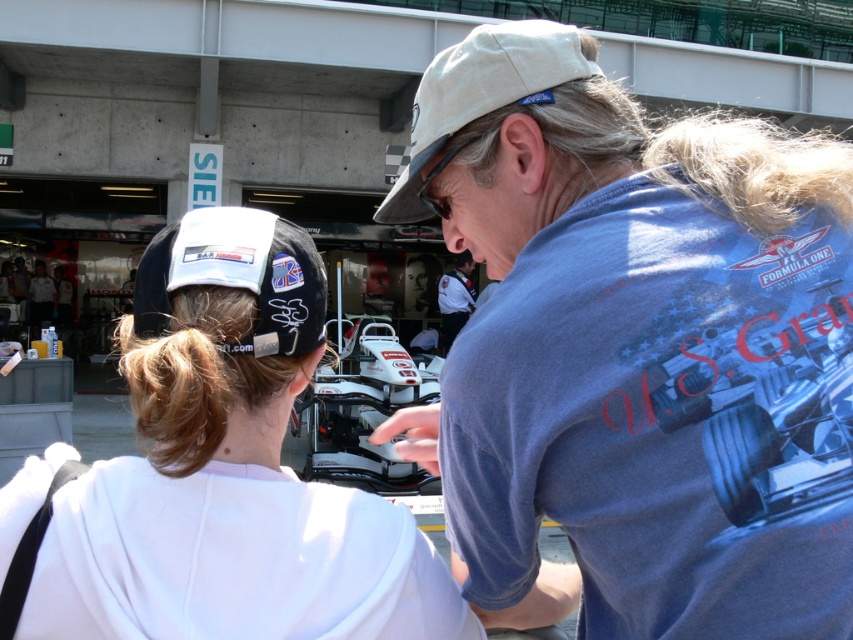
In the scene shown: You are a photographer at the motorsport event. You need to capture a photo that includes both the white matte cap at upper center and the white uniform at center. Based on their positions, which object should appear on the left side of the photo?

The white matte cap at upper center should appear on the left side of the photo because it is positioned to the left of the white uniform at center.

You are a photographer at the motorsport event and need to capture a clear shot of both the white matte cap at upper center and the white uniform at center. Considering their sizes, which object should you focus on first to ensure it appears larger in your photo?

The white matte cap at upper center has a larger size compared to the white uniform at center, so you should focus on the white matte cap at upper center first to ensure it appears larger in the photo.

Looking at this image, you are a photographer at the Formula One event. You need to capture a photo where both the white matte cap at upper left and the beige fabric baseball cap at center are visible. Which cap should you adjust your focus on first to ensure both are in the frame?

The white matte cap at upper left is closer to the viewer than the beige fabric baseball cap at center, so adjust focus on the white matte cap at upper left first to ensure both are in the frame.